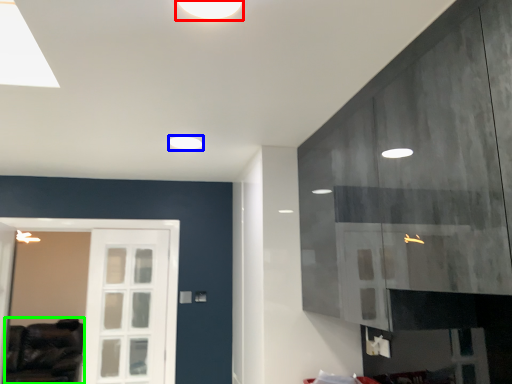
Question: Which object is the farthest from lighting (highlighted by a red box)? Choose among these: lighting (highlighted by a blue box) or furniture (highlighted by a green box).

Choices:
 (A) lighting
 (B) furniture

Answer: (B)